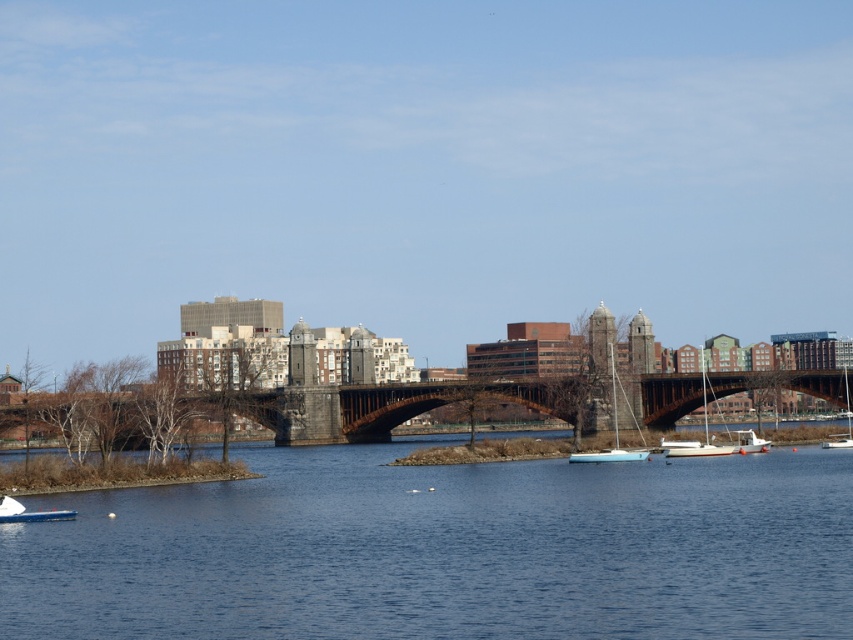
You are an architect evaluating the riverside scene. You need to determine which object occupies more space in the image between the blue water at center and the dark brown stone bridge at center. Which one is larger?

The dark brown stone bridge at center is larger than the blue water at center, as the blue water at center has a smaller size compared to the dark brown stone bridge at center.